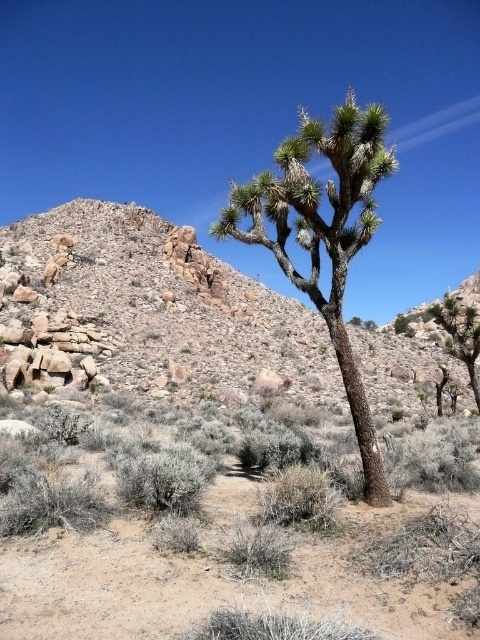
You are a hiker trying to navigate through the desert. You see the rocky desert at upper left and the green spiky plant at right. Which one would be easier to walk over?

The green spiky plant at right would be easier to walk over because it is smaller than the rocky desert at upper left.

You are standing in the desert and see the rocky desert at upper left and the green spiky plant at right. Which object is positioned to the left of the other?

The rocky desert at upper left is to the left of the green spiky plant at right.